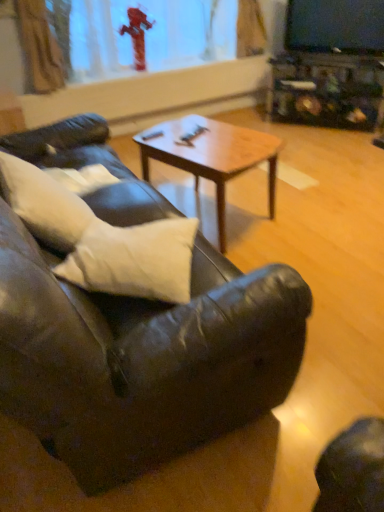
Question: Can you confirm if white soft pillow at center, which is counted as the first pillow, starting from the right, is positioned to the left of transparent glass fire hydrant at upper center?

Choices:
 (A) yes
 (B) no

Answer: (B)

Question: From a real-world perspective, is white soft pillow at center, the second pillow in the left-to-right sequence, located higher than transparent glass fire hydrant at upper center?

Choices:
 (A) yes
 (B) no

Answer: (B)

Question: Is white soft pillow at center, the second pillow in the left-to-right sequence, turned away from transparent glass fire hydrant at upper center?

Choices:
 (A) yes
 (B) no

Answer: (B)

Question: Can we say white soft pillow at center, which is counted as the first pillow, starting from the right, lies outside transparent glass fire hydrant at upper center?

Choices:
 (A) no
 (B) yes

Answer: (B)

Question: Is white soft pillow at center, which is counted as the first pillow, starting from the right, further to the viewer compared to transparent glass fire hydrant at upper center?

Choices:
 (A) yes
 (B) no

Answer: (B)

Question: Could transparent glass fire hydrant at upper center be considered to be inside white soft pillow at center, which is counted as the first pillow, starting from the right?

Choices:
 (A) yes
 (B) no

Answer: (B)

Question: Can you confirm if white soft pillow at center, the second pillow in the left-to-right sequence, is shorter than woodenmaterial/texturecoffee table at center?

Choices:
 (A) yes
 (B) no

Answer: (A)

Question: Is white soft pillow at center, the second pillow in the left-to-right sequence, positioned with its back to woodenmaterial/texturecoffee table at center?

Choices:
 (A) no
 (B) yes

Answer: (A)

Question: Is white soft pillow at center, which is counted as the first pillow, starting from the right, placed right next to woodenmaterial/texturecoffee table at center?

Choices:
 (A) no
 (B) yes

Answer: (A)

Question: Is white soft pillow at center, the second pillow in the left-to-right sequence, at the left side of woodenmaterial/texturecoffee table at center?

Choices:
 (A) yes
 (B) no

Answer: (A)

Question: Does white soft pillow at center, the second pillow in the left-to-right sequence, have a greater width compared to woodenmaterial/texturecoffee table at center?

Choices:
 (A) no
 (B) yes

Answer: (A)

Question: From a real-world perspective, does white soft pillow at center, which is counted as the first pillow, starting from the right, stand above woodenmaterial/texturecoffee table at center?

Choices:
 (A) no
 (B) yes

Answer: (B)

Question: Considering the relative sizes of woodenmaterial/texturecoffee table at center and transparent glass fire hydrant at upper center in the image provided, is woodenmaterial/texturecoffee table at center taller than transparent glass fire hydrant at upper center?

Choices:
 (A) yes
 (B) no

Answer: (B)